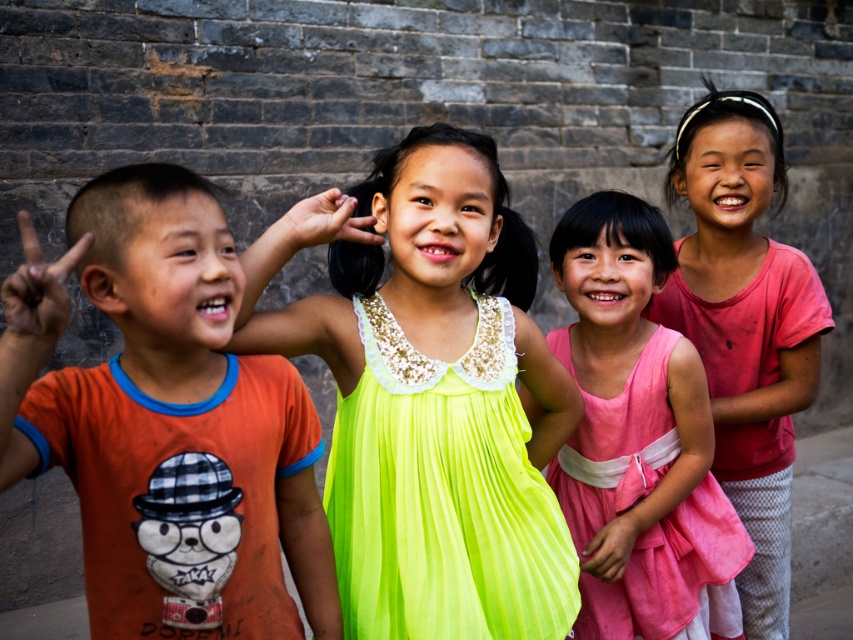
Who is more forward, (148, 461) or (741, 401)?

Positioned in front is point (148, 461).

Can you confirm if orange t-shirt at left is smaller than pink cotton shirt at right?

Correct, orange t-shirt at left occupies less space than pink cotton shirt at right.

The width and height of the screenshot is (853, 640). Find the location of `orange t-shirt at left`. orange t-shirt at left is located at coordinates 166,420.

I want to click on orange t-shirt at left, so click(x=166, y=420).

Does neon yellow fabric dress at center lie in front of pink cotton shirt at right?

Yes, it is in front of pink cotton shirt at right.

You are a GUI agent. You are given a task and a screenshot of the screen. Output one action in this format:
    pyautogui.click(x=<x>, y=<y>)
    Task: Click on the neon yellow fabric dress at center
    Image resolution: width=853 pixels, height=640 pixels.
    Given the screenshot: What is the action you would take?
    pyautogui.click(x=430, y=396)

Does neon yellow fabric dress at center have a larger size compared to orange t-shirt at left?

Indeed, neon yellow fabric dress at center has a larger size compared to orange t-shirt at left.

Who is positioned more to the left, neon yellow fabric dress at center or orange t-shirt at left?

From the viewer's perspective, orange t-shirt at left appears more on the left side.

This screenshot has height=640, width=853. Describe the element at coordinates (430, 396) in the screenshot. I see `neon yellow fabric dress at center` at that location.

I want to click on neon yellow fabric dress at center, so click(x=430, y=396).